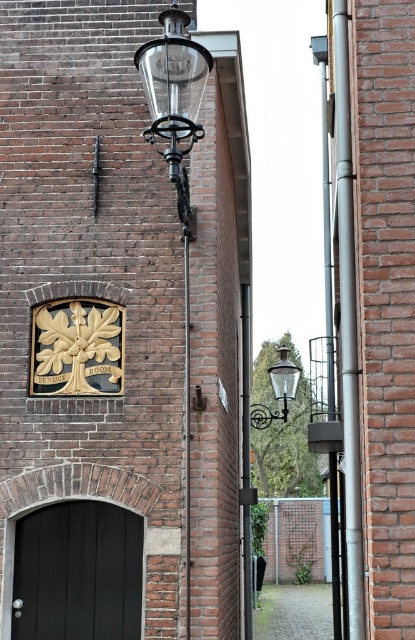
Is matte black door at lower left positioned in front of paved stone alley at lower center?

Yes, matte black door at lower left is in front of paved stone alley at lower center.

Can you confirm if matte black door at lower left is smaller than paved stone alley at lower center?

Indeed, matte black door at lower left has a smaller size compared to paved stone alley at lower center.

Is point (51, 588) less distant than point (261, 609)?

Yes.

Where is `matte black door at lower left`? The width and height of the screenshot is (415, 640). matte black door at lower left is located at coordinates (78, 572).

Which is below, paved stone alley at lower center or matte glass lamp at upper center?

Positioned lower is paved stone alley at lower center.

Is paved stone alley at lower center wider than matte glass lamp at upper center?

Correct, the width of paved stone alley at lower center exceeds that of matte glass lamp at upper center.

Locate an element on the screen. This screenshot has width=415, height=640. paved stone alley at lower center is located at coordinates (293, 612).

Between matte black door at lower left and clear glass lamp post at upper left, which one has less height?

matte black door at lower left

Who is more forward, (58,577) or (190,147)?

Point (190,147)

Who is more distant from viewer, [49,572] or [171,68]?

Positioned behind is point [49,572].

Find the location of a particular element. This screenshot has height=640, width=415. matte black door at lower left is located at coordinates (78, 572).